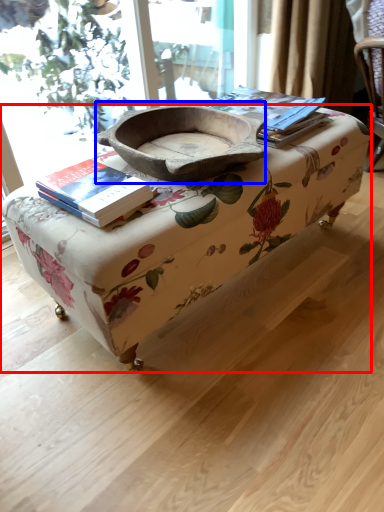
Question: Among these objects, which one is nearest to the camera, table (highlighted by a red box) or bowl (highlighted by a blue box)?

Choices:
 (A) table
 (B) bowl

Answer: (A)